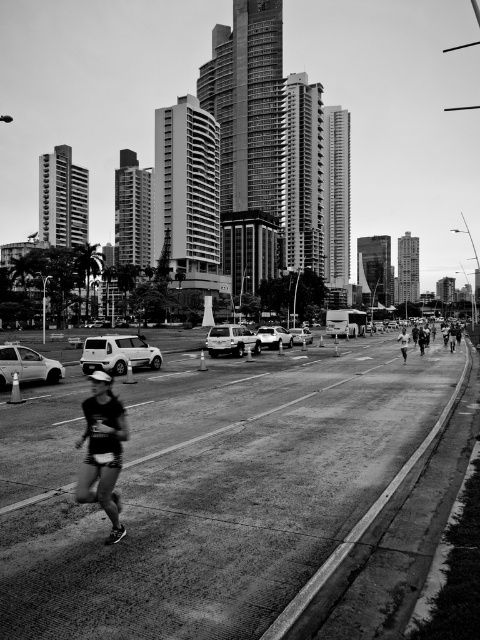
You are a pedestrian standing on the sidewalk and see both the matte silver car at left and the metallic silver sedan at center. Which one is closer to your left side?

The matte silver car at left is closer to your left side because it is positioned to the left of the metallic silver sedan at center.

You are a runner preparing to cross the street in the scene. The dark gray fabric shorts at lower left and the matte silver car at left are both in your path. Which object is wider, making it harder to navigate around?

The dark gray fabric shorts at lower left is wider than the matte silver car at left, so it would be harder to navigate around the dark gray fabric shorts at lower left.

You are a runner preparing to cross the road in the scene. There is a matte silver car at left and a metallic silver sedan at center. How far apart are these two vehicles from each other?

The matte silver car at left and the metallic silver sedan at center are 30.38 meters apart.